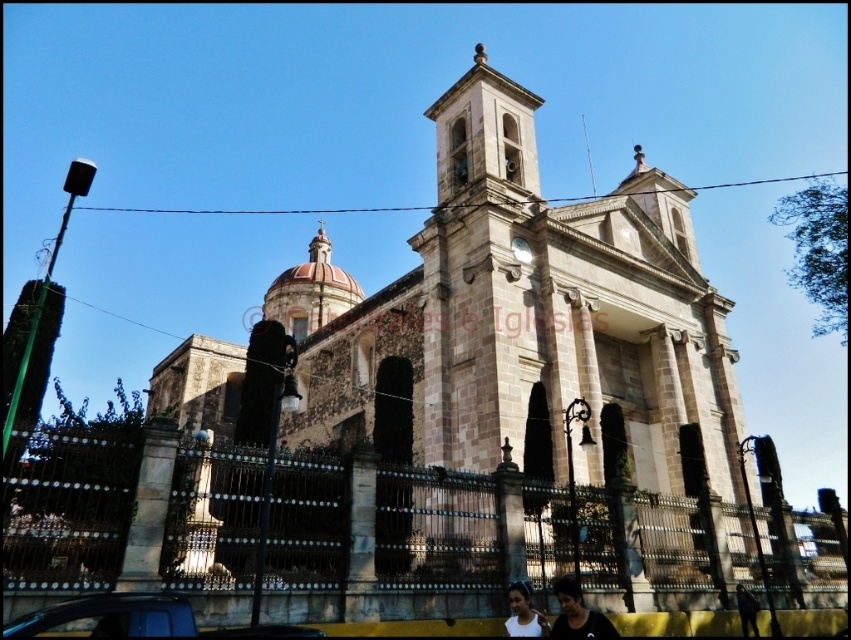
Is point (36, 618) farther from camera compared to point (598, 620)?

No, it is not.

Which is in front, point (95, 604) or point (564, 586)?

Point (95, 604) is more forward.

Does point (38, 611) come closer to viewer compared to point (561, 589)?

Yes.

I want to click on metallic blue car at lower left, so click(132, 618).

Which is in front, point (236, 632) or point (513, 618)?

Positioned in front is point (236, 632).

Which is more to the left, metallic blue car at lower left or white matte shirt at lower center?

metallic blue car at lower left is more to the left.

Between point (109, 600) and point (512, 621), which one is positioned behind?

Point (512, 621)

Locate an element on the screen. This screenshot has width=851, height=640. metallic blue car at lower left is located at coordinates (132, 618).

Is stone church at center bigger than white matte shirt at lower center?

Indeed, stone church at center has a larger size compared to white matte shirt at lower center.

Does stone church at center come in front of white matte shirt at lower center?

That is False.

Is point (557, 474) less distant than point (545, 625)?

No, it is behind (545, 625).

The image size is (851, 640). I want to click on stone church at center, so click(x=524, y=317).